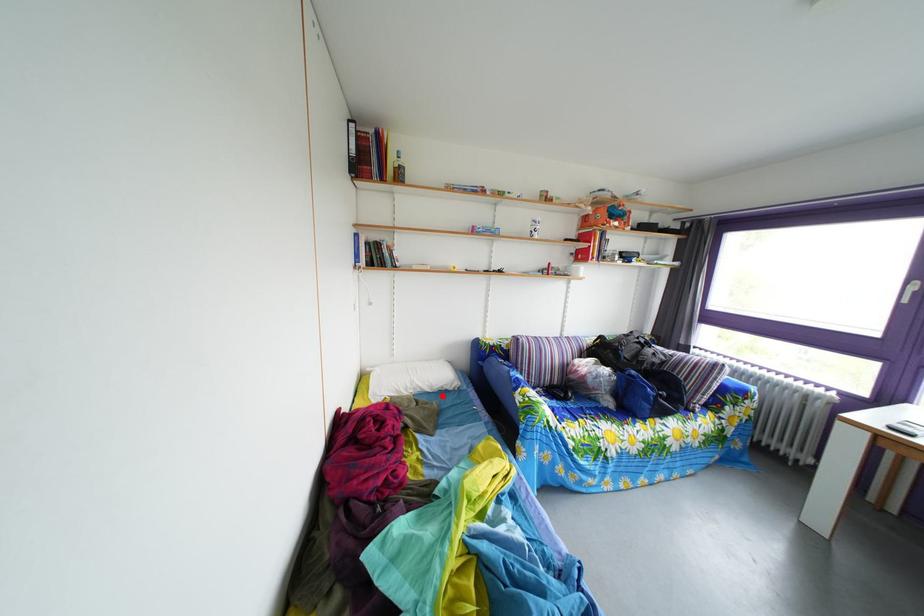
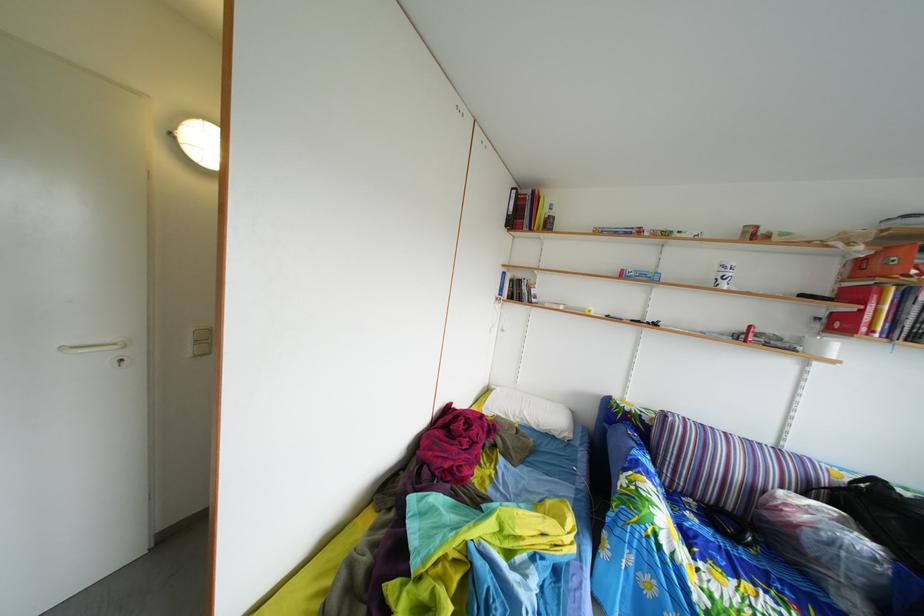
Question: I am providing you with two images of the same scene from different viewpoints. A red point is marked on the first image. Can you still see the location of the red point in image 2?

Choices:
 (A) Yes
 (B) No

Answer: (A)